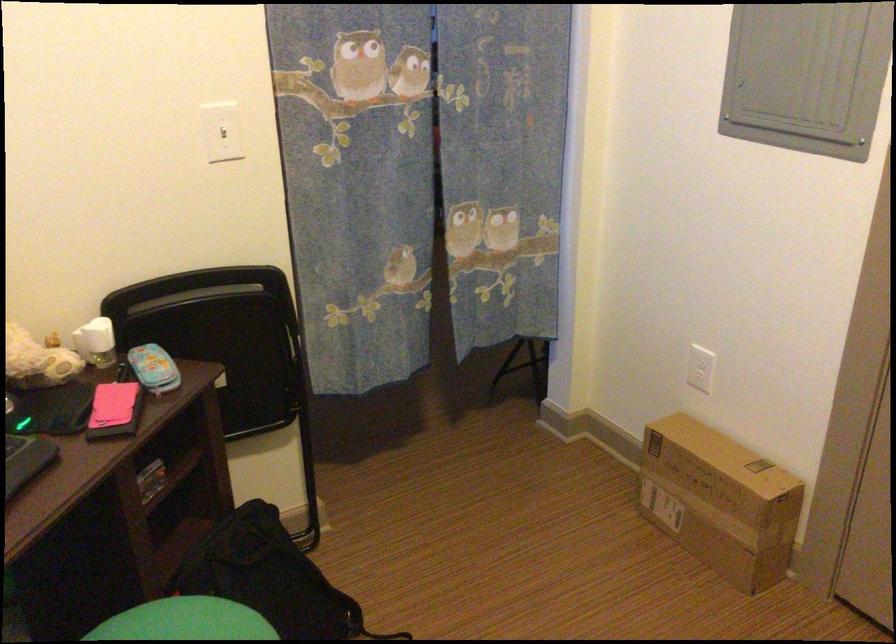
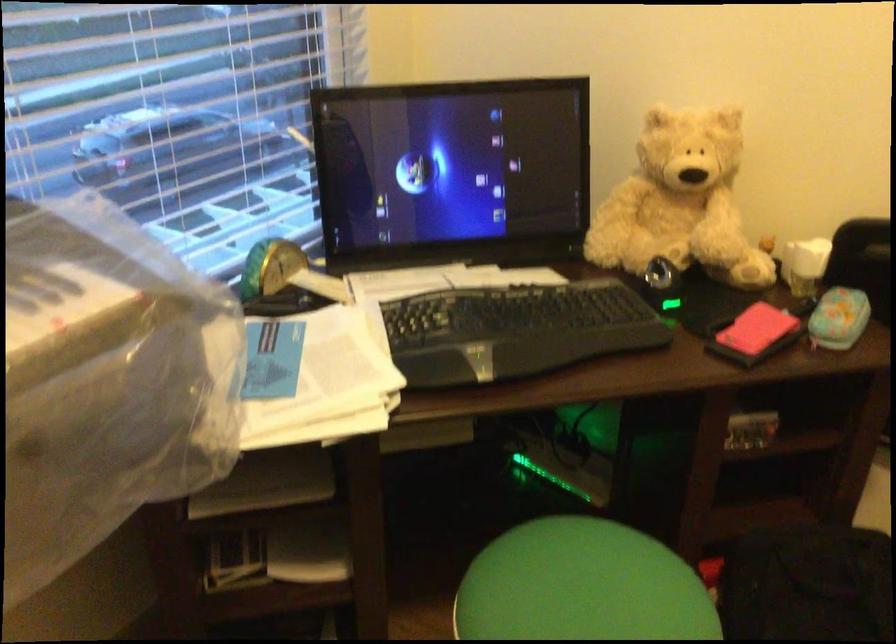
Consider the image. Based on the continuous images, in which direction is the camera rotating?

The camera rotated toward left-down.